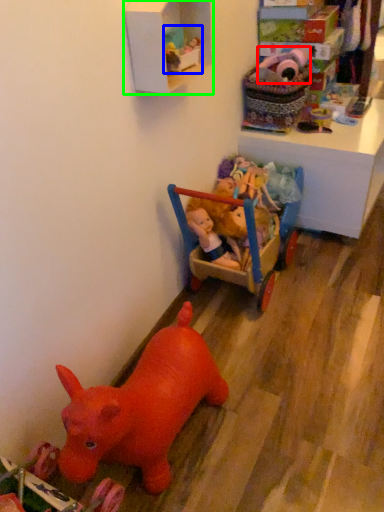
Question: Which is farther away from toy (highlighted by a red box)? toy (highlighted by a blue box) or shelf (highlighted by a green box)?

Choices:
 (A) toy
 (B) shelf

Answer: (A)